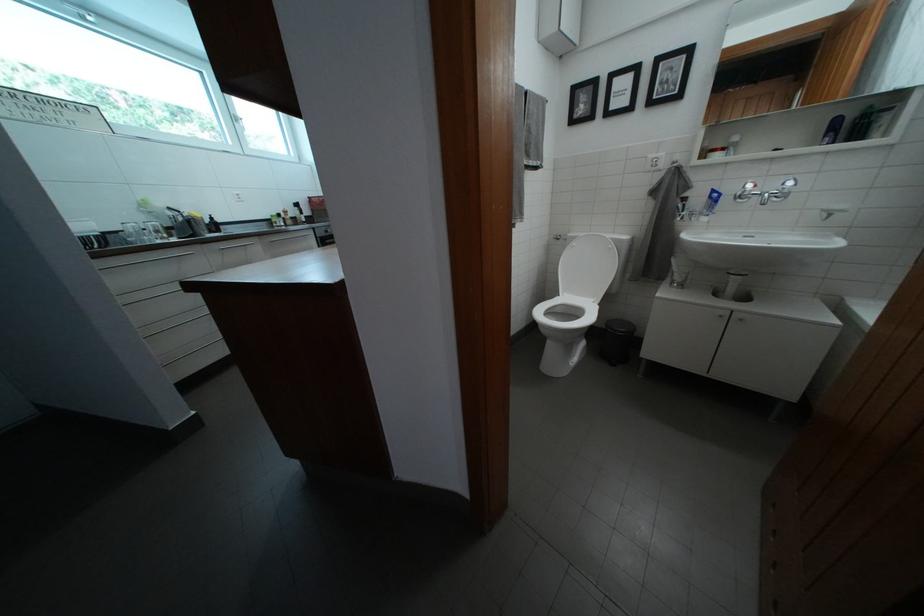
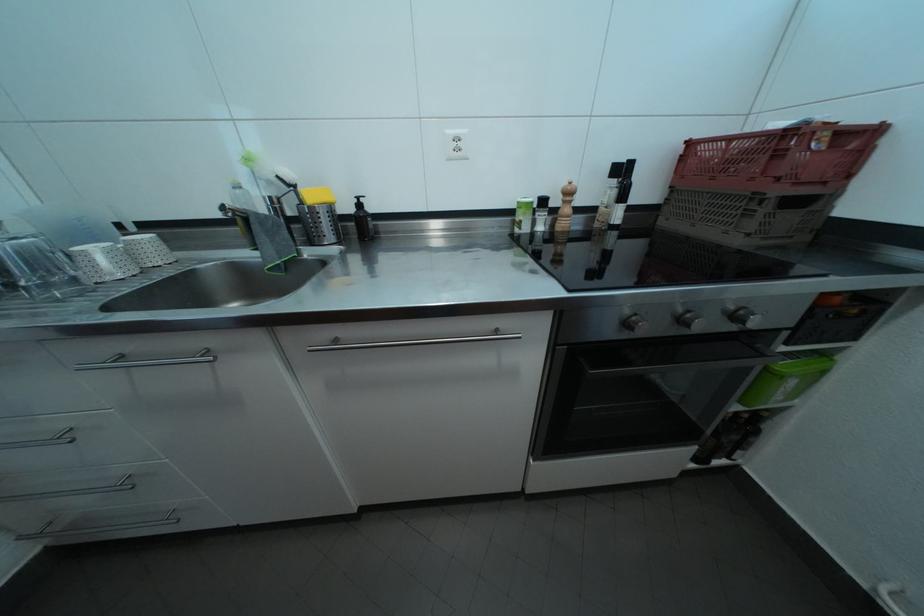
Find the pixel in the second image that matches point 306,211 in the first image.

(630, 176)